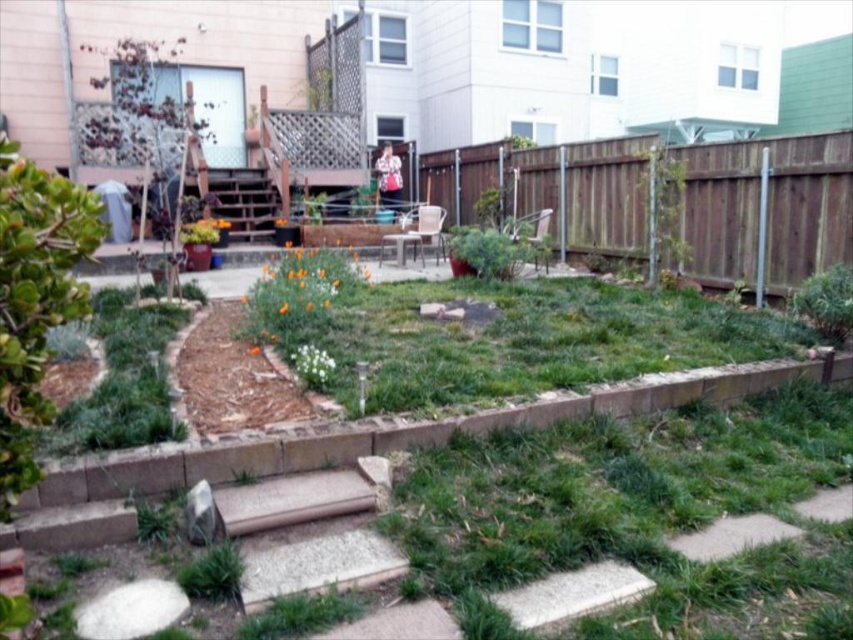
Question: Among these objects, which one is nearest to the camera?

Choices:
 (A) brown wood stair at lower center
 (B) brown wooden fence at center
 (C) green leafy plant at upper right

Answer: (A)

Question: Among these points, which one is farthest from the camera?

Choices:
 (A) (788, 273)
 (B) (660, 157)
 (C) (291, 496)

Answer: (B)

Question: Is brown wooden fence at center smaller than green leafy plant at upper right?

Choices:
 (A) no
 (B) yes

Answer: (A)

Question: Does brown wooden fence at center appear on the left side of brown wood stair at lower center?

Choices:
 (A) yes
 (B) no

Answer: (B)

Question: Does brown wooden fence at center have a greater width compared to green leafy plant at upper right?

Choices:
 (A) yes
 (B) no

Answer: (A)

Question: Which point is closer to the camera?

Choices:
 (A) (259, 572)
 (B) (601, 241)

Answer: (A)